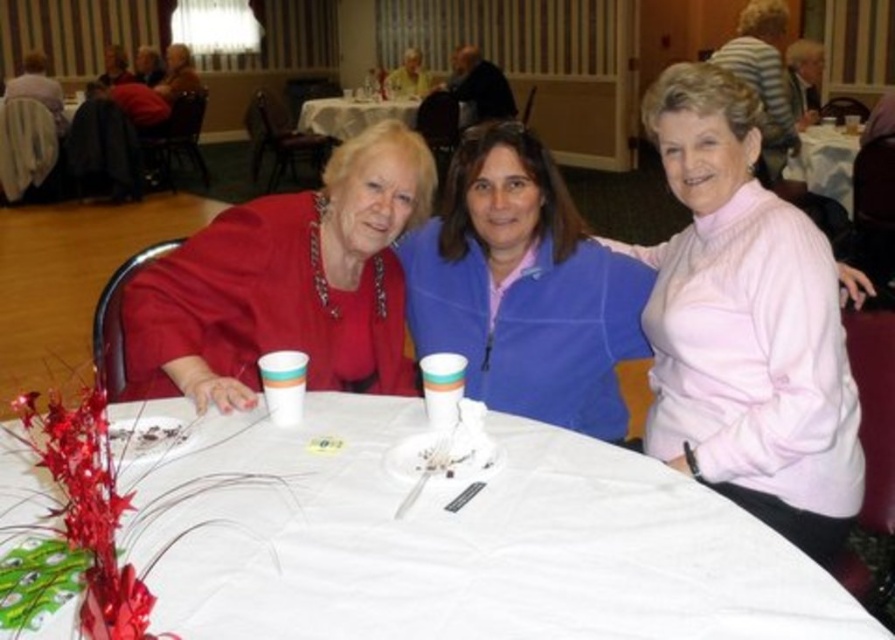
You are standing at the center of the banquet hall and want to reach the two points on the table. Which point, point (472, 630) or point (176, 381), is closer to you?

Point (472, 630) is in front of point (176, 381), so point (176, 381) is closer to you.

Looking at this image, you are a photographer standing at the back of the banquet hall. You want to take a photo of the white fabric tablecloth at center and the matte red dress at center. Which object will appear larger in your photo?

The white fabric tablecloth at center will appear larger in the photo because it is closer to the viewer than the matte red dress at center.

You are planning to place a new decorative item on the table. The matte red dress at center and the white paper plate at upper center are already there. Which object should you avoid placing the new item near if you want to conserve space?

You should avoid placing the new item near the matte red dress at center because it occupies less space than the white paper plate at upper center, so there is more space available near the white paper plate.